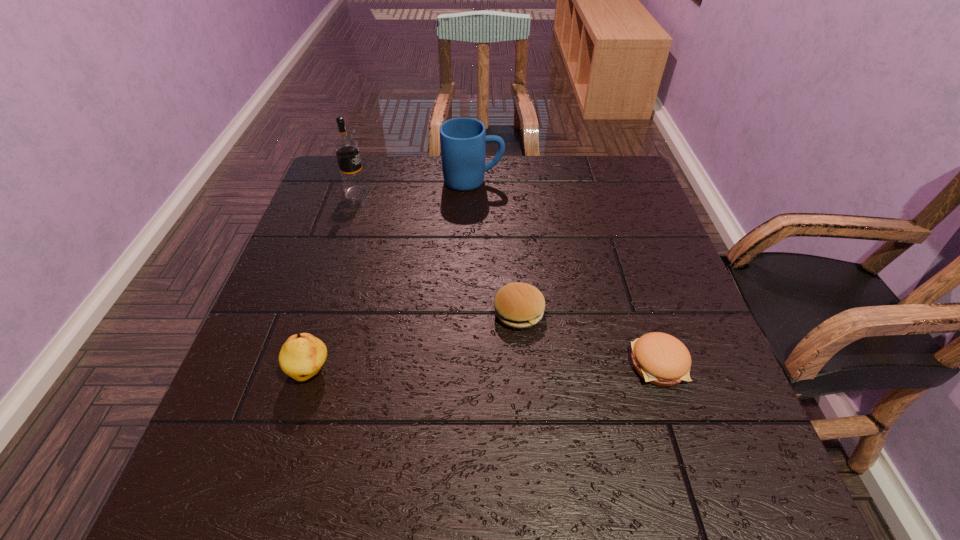
Identify the location of the tallest object. (346, 148).

Locate an element on the screen. mug is located at coordinates (463, 140).

I want to click on the third tallest object, so click(302, 356).

You are a GUI agent. You are given a task and a screenshot of the screen. Output one action in this format:
    pyautogui.click(x=<x>, y=<y>)
    Task: Click on the farther patty
    The width and height of the screenshot is (960, 540).
    Given the screenshot: What is the action you would take?
    pyautogui.click(x=518, y=305)

Identify the location of the left patty. The image size is (960, 540). (518, 305).

At what (x,y) coordinates should I click in order to perform the action: click on the right patty. Please return your answer as a coordinate pair (x, y). The height and width of the screenshot is (540, 960). Looking at the image, I should click on (661, 359).

The width and height of the screenshot is (960, 540). In order to click on the nearer patty in this screenshot , I will do `click(661, 359)`.

The width and height of the screenshot is (960, 540). What are the coordinates of `free space located on the label of the vodka` in the screenshot? It's located at (456, 192).

Where is `vacant space positioned 0.350m on the side of the fourth shortest object with the handle`? The image size is (960, 540). vacant space positioned 0.350m on the side of the fourth shortest object with the handle is located at coordinates (626, 181).

You are a GUI agent. You are given a task and a screenshot of the screen. Output one action in this format:
    pyautogui.click(x=<x>, y=<y>)
    Task: Click on the vacant space located on the back of the third tallest object
    The width and height of the screenshot is (960, 540).
    Given the screenshot: What is the action you would take?
    pyautogui.click(x=356, y=223)